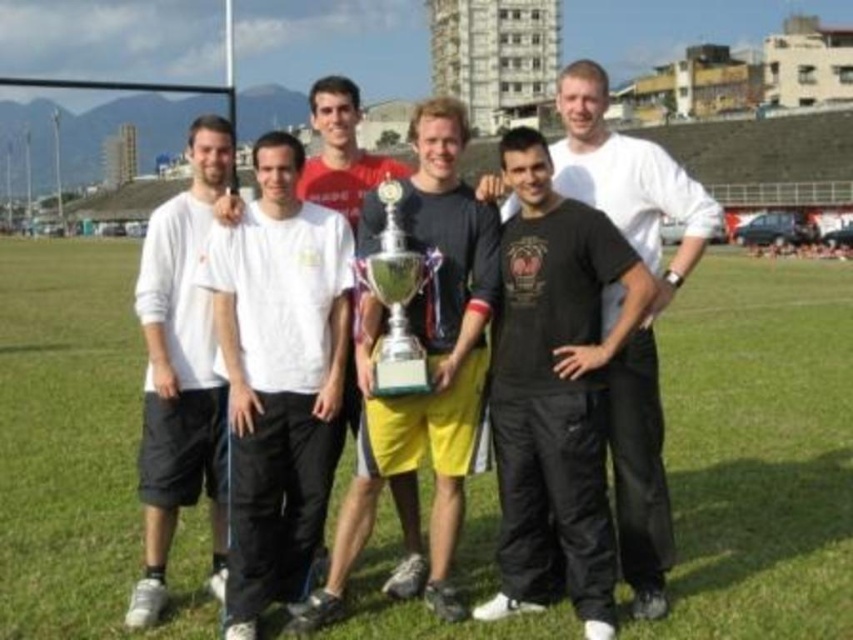
Question: Which of the following is the farthest from the observer?

Choices:
 (A) (277, 593)
 (B) (413, 355)
 (C) (743, 468)

Answer: (C)

Question: Can you confirm if white matte t-shirt at center is bigger than metallic trophy at center?

Choices:
 (A) yes
 (B) no

Answer: (B)

Question: From the image, what is the correct spatial relationship of green grass at center in relation to metallic trophy at center?

Choices:
 (A) right
 (B) left

Answer: (A)

Question: Which point is closer to the camera taking this photo?

Choices:
 (A) (241, 403)
 (B) (424, 221)
 (C) (161, 547)

Answer: (C)

Question: Based on their relative distances, which object is nearer to the silver metallic trophy at center?

Choices:
 (A) metallic trophy at center
 (B) black matte pants at center

Answer: (A)

Question: Can you confirm if white matte t-shirt at center is positioned to the right of metallic trophy at center?

Choices:
 (A) no
 (B) yes

Answer: (A)